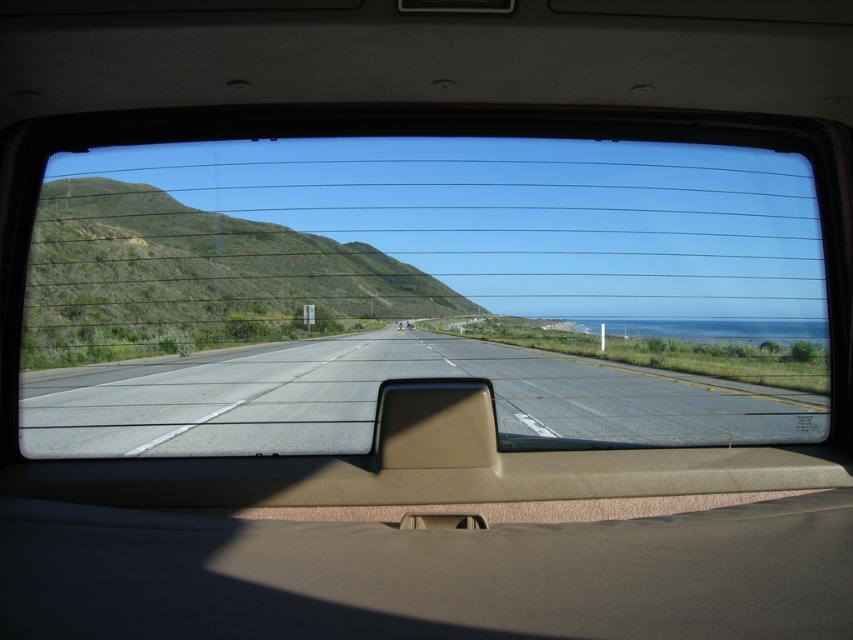
Does asphalt road at center come behind tan matte rearview mirror at center?

Yes, asphalt road at center is behind tan matte rearview mirror at center.

Does asphalt road at center have a lesser height compared to tan matte rearview mirror at center?

In fact, asphalt road at center may be taller than tan matte rearview mirror at center.

Describe the element at coordinates (375, 397) in the screenshot. I see `asphalt road at center` at that location.

Where is `asphalt road at center`? This screenshot has height=640, width=853. asphalt road at center is located at coordinates (375, 397).

Between transparent glass windshield at center and tan matte rearview mirror at center, which one appears on the right side from the viewer's perspective?

Positioned to the right is transparent glass windshield at center.

Who is higher up, transparent glass windshield at center or tan matte rearview mirror at center?

Positioned higher is transparent glass windshield at center.

What do you see at coordinates (421, 291) in the screenshot? I see `transparent glass windshield at center` at bounding box center [421, 291].

The image size is (853, 640). Find the location of `transparent glass windshield at center`. transparent glass windshield at center is located at coordinates (421, 291).

Is transparent glass windshield at center positioned at the back of asphalt road at center?

Yes, it is.

Is point (706, 291) closer to camera compared to point (370, 406)?

That is False.

Locate an element on the screen. This screenshot has height=640, width=853. transparent glass windshield at center is located at coordinates (421, 291).